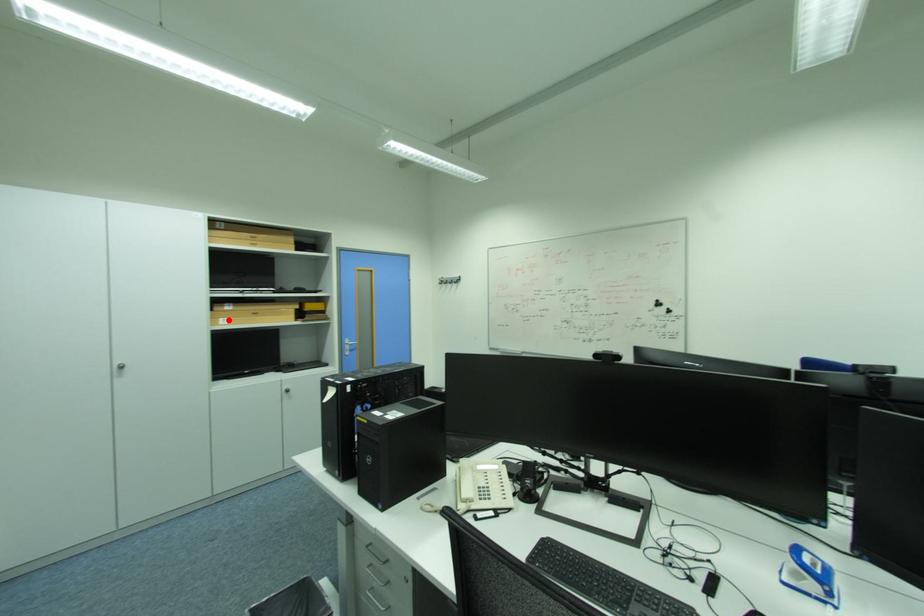
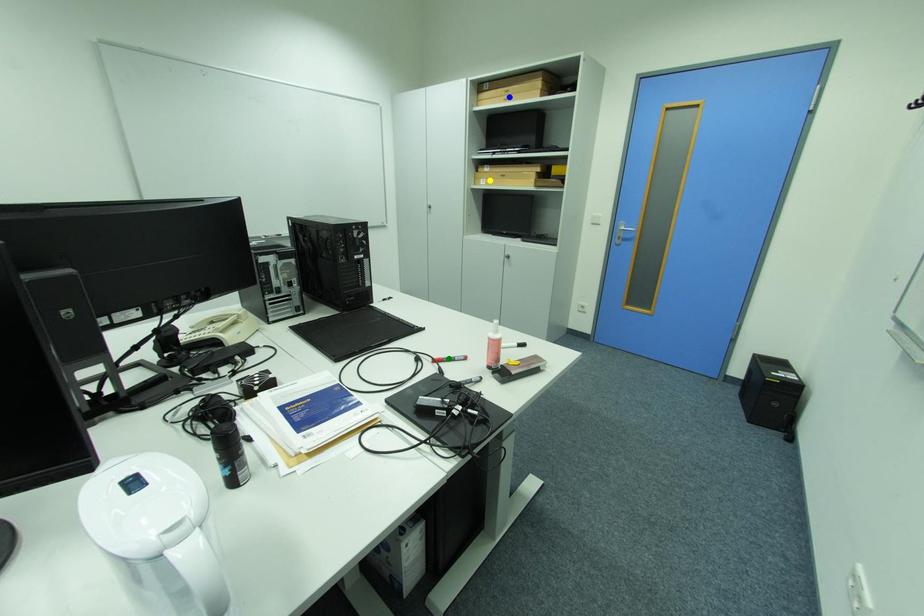
Question: I am providing you with two images of the same scene from different viewpoints. A red point is marked on the first image. You are given multiple points on the second image. Which point in image 2 is actually the same real-world point as the red point in image 1?

Choices:
 (A) yellow point
 (B) green point
 (C) blue point

Answer: (A)